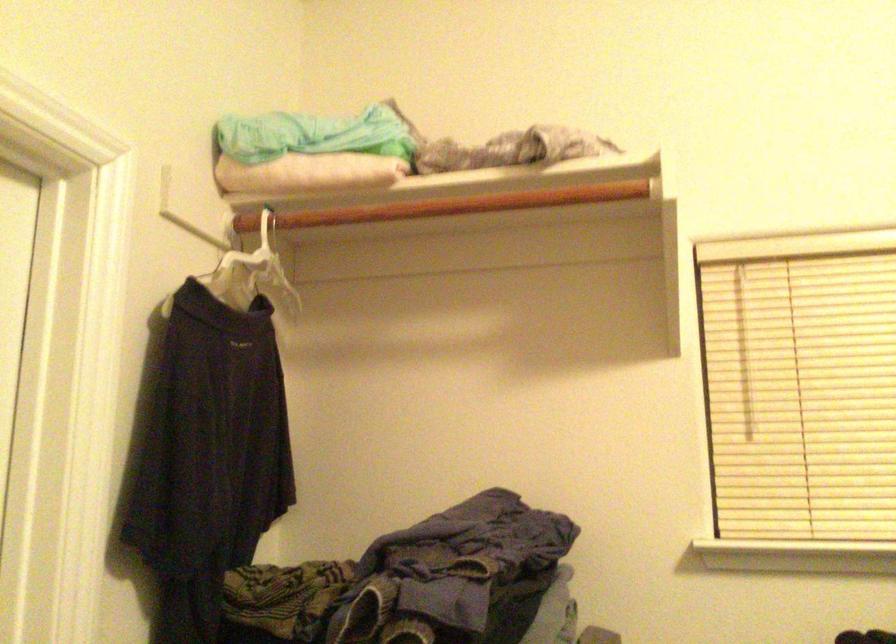
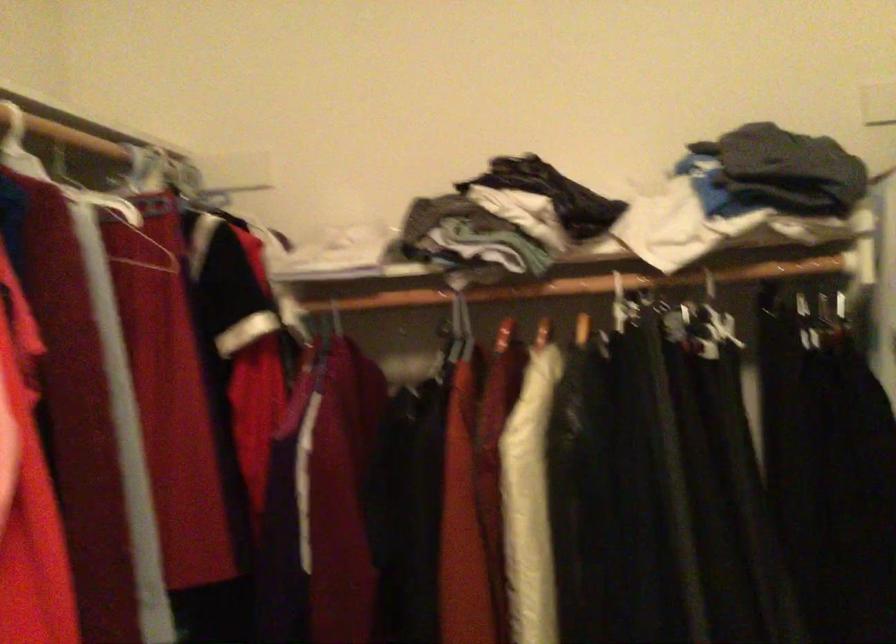
Question: The images are taken continuously from a first-person perspective. In which direction is your viewpoint rotating?

Choices:
 (A) Left
 (B) Right
 (C) Up
 (D) Down

Answer: (B)